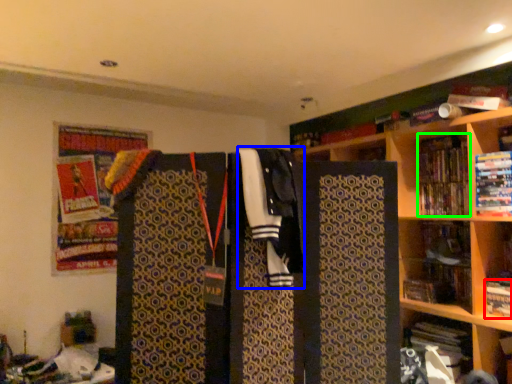
Question: Considering the real-world distances, which object is farthest from book (highlighted by a red box)? clothing (highlighted by a blue box) or book (highlighted by a green box)?

Choices:
 (A) clothing
 (B) book

Answer: (A)